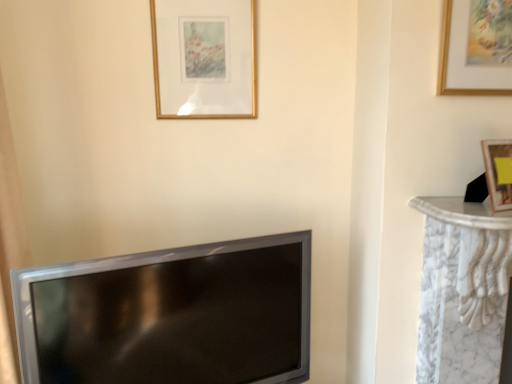
Question: Can you confirm if gold wooden picture frame at upper right, which is counted as the second picture frame, starting from the back, is bigger than matte black tv at lower left?

Choices:
 (A) yes
 (B) no

Answer: (B)

Question: Considering the relative positions of gold wooden picture frame at upper right, the first picture frame from the front, and matte black tv at lower left in the image provided, is gold wooden picture frame at upper right, the first picture frame from the front, to the left of matte black tv at lower left from the viewer's perspective?

Choices:
 (A) no
 (B) yes

Answer: (A)

Question: Is gold wooden picture frame at upper right, the second picture frame in the left-to-right sequence, completely or partially outside of matte black tv at lower left?

Choices:
 (A) yes
 (B) no

Answer: (A)

Question: From a real-world perspective, is gold wooden picture frame at upper right, acting as the 1th picture frame starting from the right, beneath matte black tv at lower left?

Choices:
 (A) yes
 (B) no

Answer: (B)

Question: Are gold wooden picture frame at upper right, the first picture frame from the front, and matte black tv at lower left far apart?

Choices:
 (A) no
 (B) yes

Answer: (A)

Question: From the image's perspective, is gold wooden picture frame at upper right, the first picture frame from the front, over matte black tv at lower left?

Choices:
 (A) no
 (B) yes

Answer: (B)

Question: Is gold wooden picture frame at upper center, which ranks as the 2th picture frame in right-to-left order, positioned before gold wooden picture frame at upper right, the second picture frame in the left-to-right sequence?

Choices:
 (A) no
 (B) yes

Answer: (A)

Question: From a real-world perspective, is gold wooden picture frame at upper center, which is the first picture frame from left to right, physically above gold wooden picture frame at upper right, the second picture frame in the left-to-right sequence?

Choices:
 (A) yes
 (B) no

Answer: (A)

Question: Is gold wooden picture frame at upper center, which is the first picture frame from left to right, shorter than gold wooden picture frame at upper right, acting as the 1th picture frame starting from the right?

Choices:
 (A) yes
 (B) no

Answer: (B)

Question: Could you tell me if gold wooden picture frame at upper center, which ranks as the 2th picture frame in right-to-left order, is turned towards gold wooden picture frame at upper right, acting as the 1th picture frame starting from the right?

Choices:
 (A) no
 (B) yes

Answer: (A)

Question: From the image's perspective, is gold wooden picture frame at upper center, placed as the 2th picture frame when sorted from front to back, located above gold wooden picture frame at upper right, the first picture frame from the front?

Choices:
 (A) no
 (B) yes

Answer: (B)

Question: Considering the relative sizes of gold wooden picture frame at upper center, positioned as the first picture frame in back-to-front order, and gold wooden picture frame at upper right, acting as the 1th picture frame starting from the right, in the image provided, is gold wooden picture frame at upper center, positioned as the first picture frame in back-to-front order, wider than gold wooden picture frame at upper right, acting as the 1th picture frame starting from the right,?

Choices:
 (A) no
 (B) yes

Answer: (A)

Question: Considering the relative sizes of gold wooden picture frame at upper center, placed as the 2th picture frame when sorted from front to back, and matte black tv at lower left in the image provided, is gold wooden picture frame at upper center, placed as the 2th picture frame when sorted from front to back, bigger than matte black tv at lower left?

Choices:
 (A) no
 (B) yes

Answer: (A)